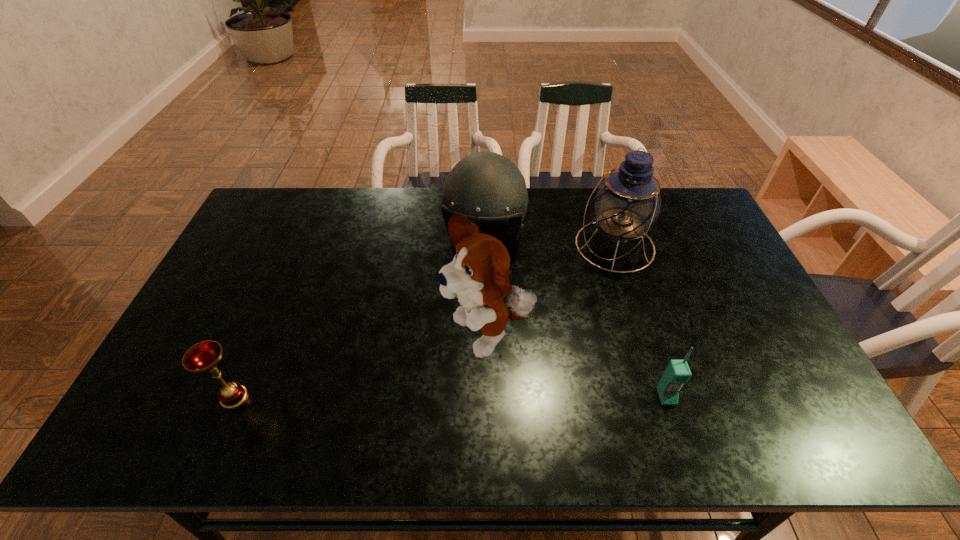
This screenshot has height=540, width=960. What are the coordinates of `empty space that is in between the football helmet and the chalice` in the screenshot? It's located at (x=359, y=316).

Identify the location of vacant space in between the lantern and the cellular telephone. The width and height of the screenshot is (960, 540). (640, 321).

Where is `free space between the third farthest object and the chalice`? free space between the third farthest object and the chalice is located at coordinates (361, 368).

Identify the location of vacant space that is in between the lantern and the third tallest object. (549, 240).

Where is `object that is the fourth closest to the cellular telephone`? The height and width of the screenshot is (540, 960). object that is the fourth closest to the cellular telephone is located at coordinates (203, 357).

The image size is (960, 540). In order to click on the third closest object to the cellular telephone in this screenshot , I will do `click(485, 186)`.

Image resolution: width=960 pixels, height=540 pixels. I want to click on free space in the image that satisfies the following two spatial constraints: 1. on the back side of the chalice; 2. on the left side of the lantern, so click(299, 246).

Find the location of a particular element. vacant space that satisfies the following two spatial constraints: 1. on the back side of the football helmet; 2. on the left side of the chalice is located at coordinates (303, 235).